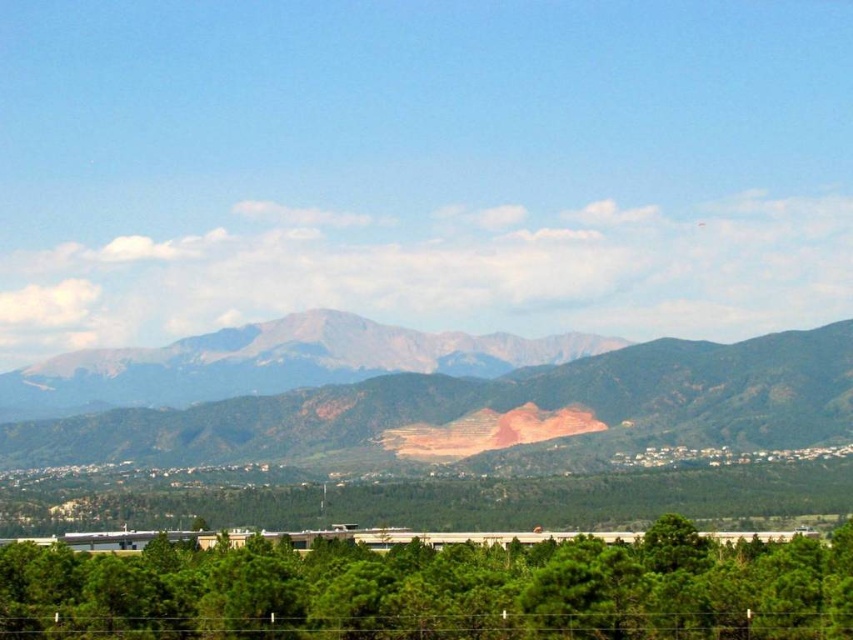
In the scene shown: You are standing at the point marked as point (437, 589) in the image. What object is directly in front of you?

The green leafy tree at lower center is directly in front of you at point (437, 589).

Consider the image. You are a hiker standing at the edge of the forest looking towards the mountains. You see the green leafy tree at lower center and the rugged brown mountain range at center. Which object is closer to you?

The green leafy tree at lower center is closer to you since it is positioned in front of the rugged brown mountain range at center.

In the scene shown: You are standing at the base of the rugged brown mountain range at center and want to reach the green leafy tree at lower center. Which direction should you move to get there?

You should move downward towards the green leafy tree at lower center since it is located below the rugged brown mountain range at center.